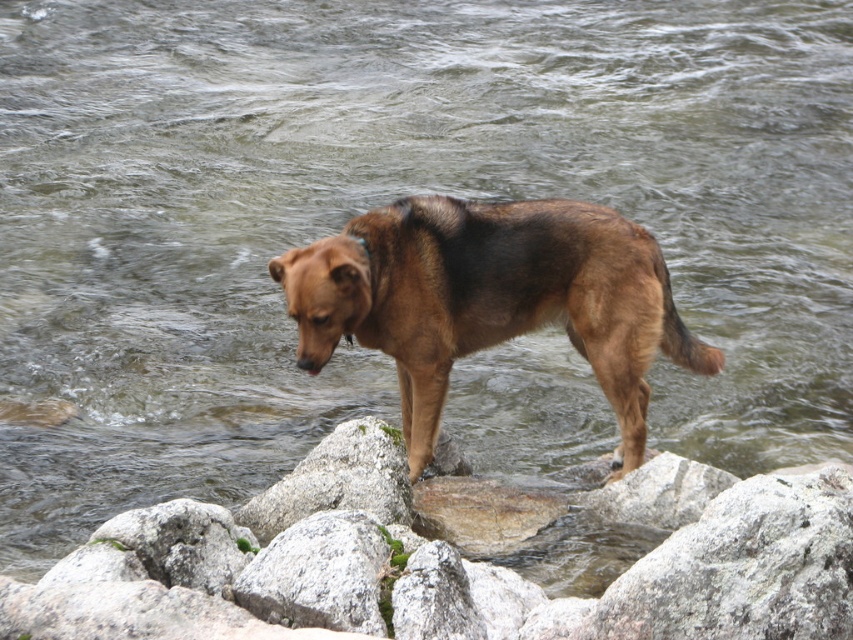
Is point (254, 561) closer to camera compared to point (555, 273)?

Yes, point (254, 561) is in front of point (555, 273).

Is gray rock at center shorter than brown furry dog at center?

Yes, gray rock at center is shorter than brown furry dog at center.

The image size is (853, 640). I want to click on gray rock at center, so coord(450,563).

You are a GUI agent. You are given a task and a screenshot of the screen. Output one action in this format:
    pyautogui.click(x=<x>, y=<y>)
    Task: Click on the gray rock at center
    Image resolution: width=853 pixels, height=640 pixels.
    Given the screenshot: What is the action you would take?
    pyautogui.click(x=450, y=563)